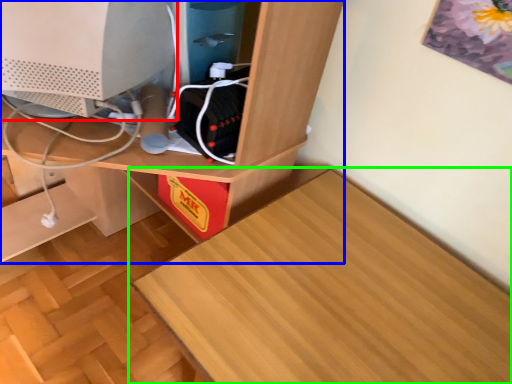
Question: Considering the real-world distances, which object is closest to computer monitor (highlighted by a red box)? desk (highlighted by a blue box) or table (highlighted by a green box).

Choices:
 (A) desk
 (B) table

Answer: (A)